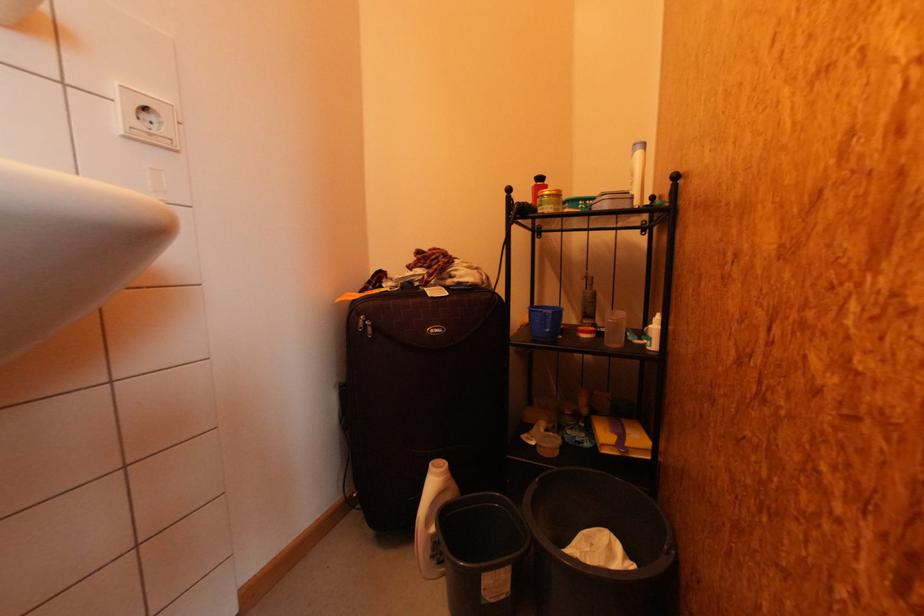
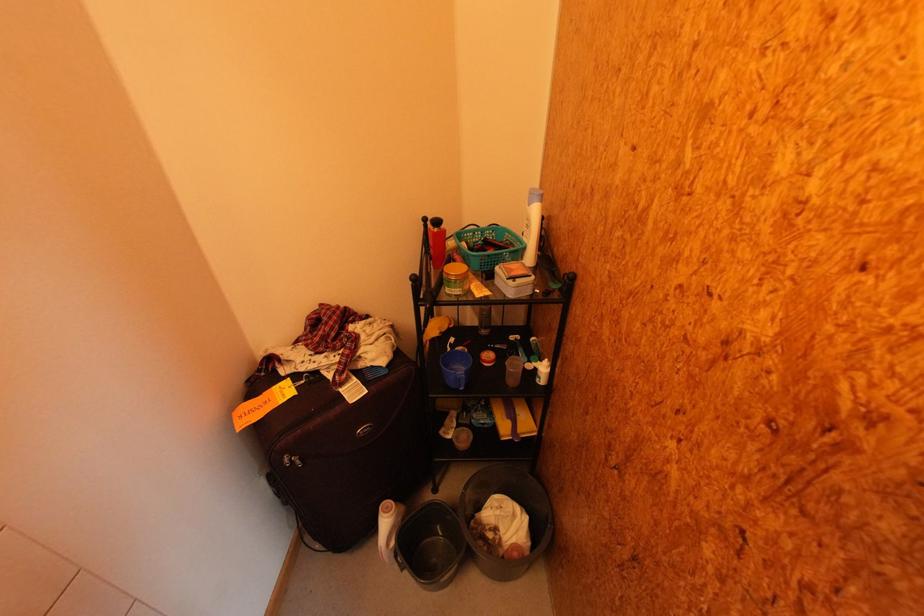
The point at (432, 525) is marked in the first image. Where is the corresponding point in the second image?

(393, 546)